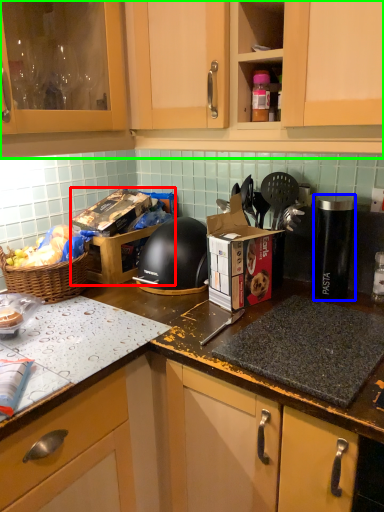
Question: Considering the real-world distances, which object is farthest from cardboard box (highlighted by a red box)? appliance (highlighted by a blue box) or cabinetry (highlighted by a green box)?

Choices:
 (A) appliance
 (B) cabinetry

Answer: (A)